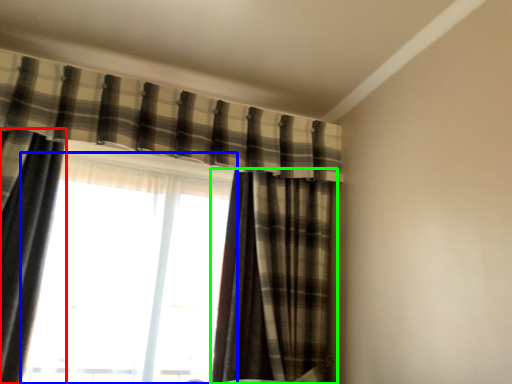
Question: Estimate the real-world distances between objects in this image. Which object is farther from curtain (highlighted by a red box), window (highlighted by a blue box) or curtain (highlighted by a green box)?

Choices:
 (A) window
 (B) curtain

Answer: (B)